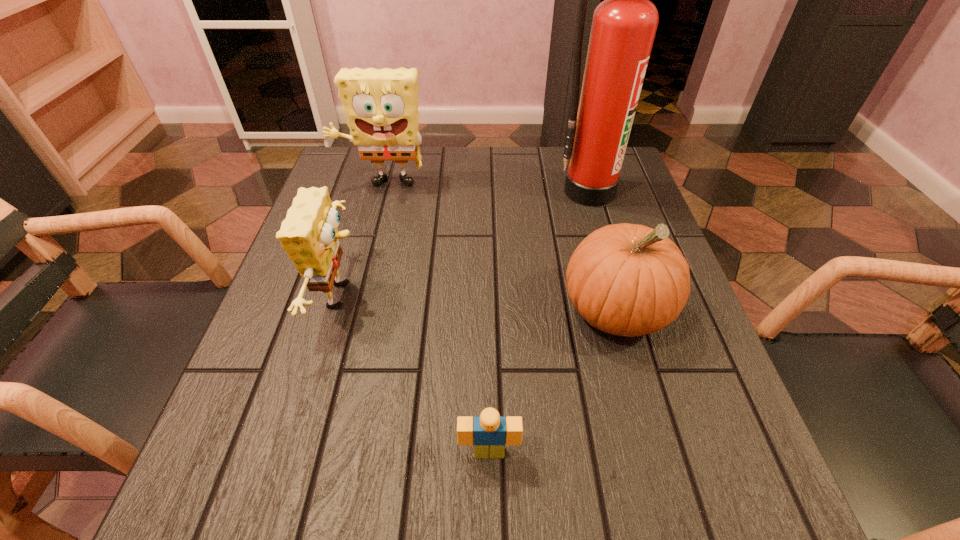
Identify the location of free region located 0.220m on the face of the nearer sponge. This screenshot has width=960, height=540. (479, 295).

At what (x,y) coordinates should I click in order to perform the action: click on free region located 0.080m on the face of the third object from left to right. Please return your answer as a coordinate pair (x, y). The height and width of the screenshot is (540, 960). Looking at the image, I should click on click(x=490, y=522).

I want to click on fire extinguisher present at the far edge, so click(624, 25).

Where is `sponge at the far edge`? Image resolution: width=960 pixels, height=540 pixels. sponge at the far edge is located at coordinates (381, 105).

Find the location of a particular element. The height and width of the screenshot is (540, 960). fire extinguisher that is at the right edge is located at coordinates (624, 25).

I want to click on pumpkin located in the right edge section of the desktop, so click(629, 280).

What are the coordinates of `object that is positioned at the far left corner` in the screenshot? It's located at (381, 105).

What are the coordinates of `object present at the far right corner` in the screenshot? It's located at (624, 25).

In the image, there is a desktop. Where is `vacant region at the far edge`? Image resolution: width=960 pixels, height=540 pixels. vacant region at the far edge is located at coordinates (461, 189).

The image size is (960, 540). What are the coordinates of `vacant space at the near edge` in the screenshot? It's located at (537, 475).